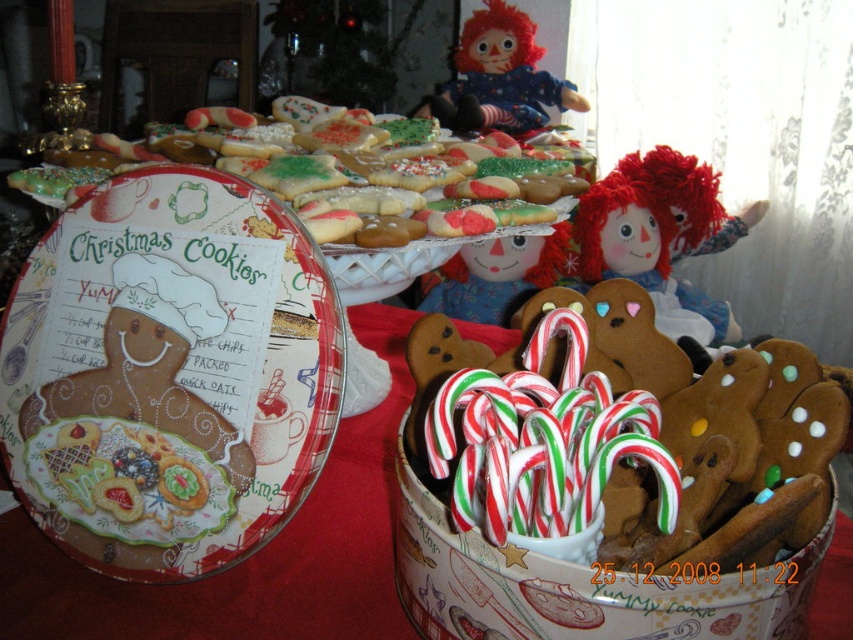
Question: Does matte cardboard platter at center have a lesser width compared to matte plastic doll at upper center?

Choices:
 (A) yes
 (B) no

Answer: (A)

Question: Which point is closer to the camera?

Choices:
 (A) (381, 189)
 (B) (741, 227)
 (C) (283, 449)
 (D) (515, 19)

Answer: (C)

Question: Is glazed sugar cookies at upper center further to the viewer compared to fluffy red-haired doll at center?

Choices:
 (A) no
 (B) yes

Answer: (A)

Question: Among these points, which one is nearest to the camera?

Choices:
 (A) (256, 305)
 (B) (497, 17)
 (C) (352, 115)

Answer: (A)

Question: Which point appears closest to the camera in this image?

Choices:
 (A) (694, 332)
 (B) (281, 152)

Answer: (B)

Question: Does matte cardboard platter at center have a larger size compared to glazed sugar cookies at upper center?

Choices:
 (A) yes
 (B) no

Answer: (B)